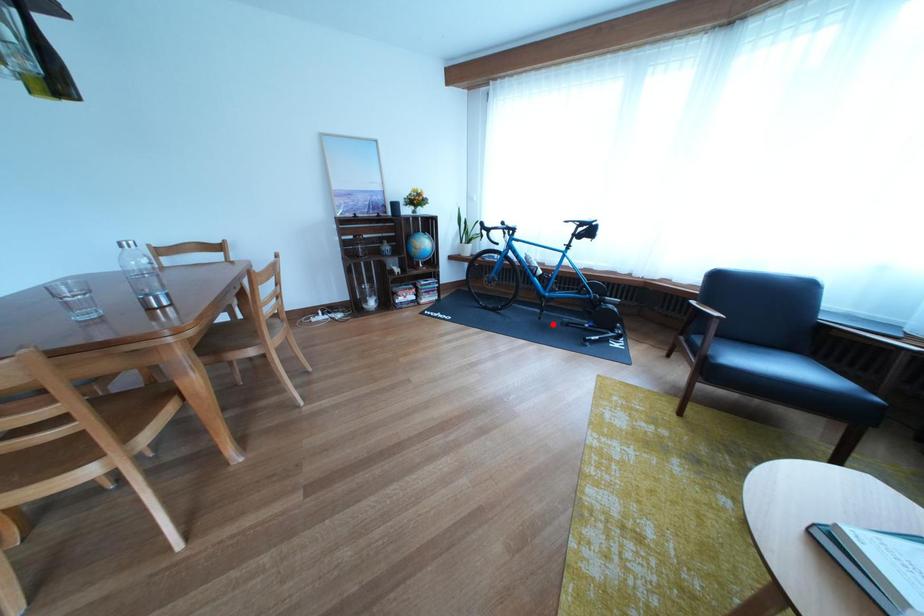
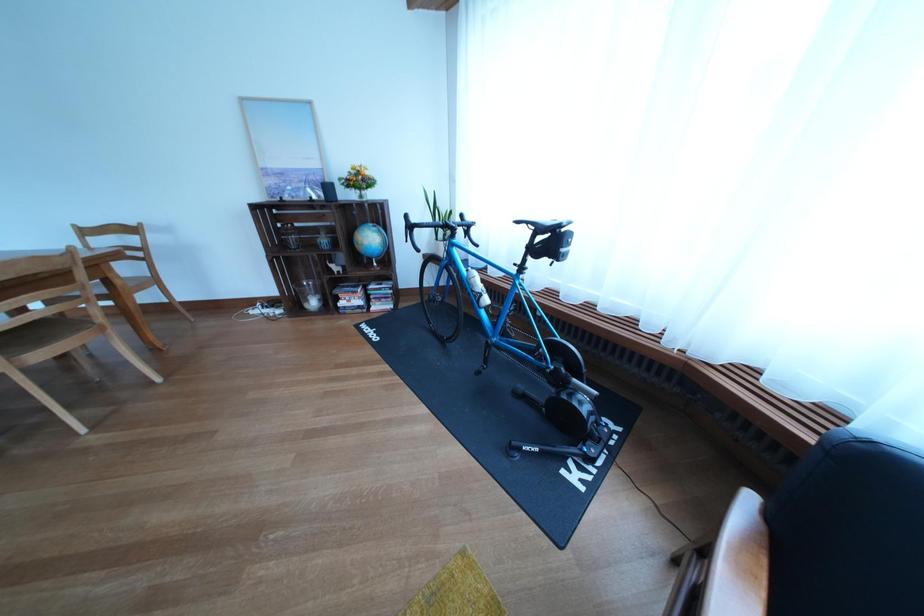
Question: I am providing you with two images of the same scene from different viewpoints. A red point is shown in image1. For the corresponding object point in image2, is it positioned nearer or farther from the camera?

Choices:
 (A) Nearer
 (B) Farther

Answer: (B)